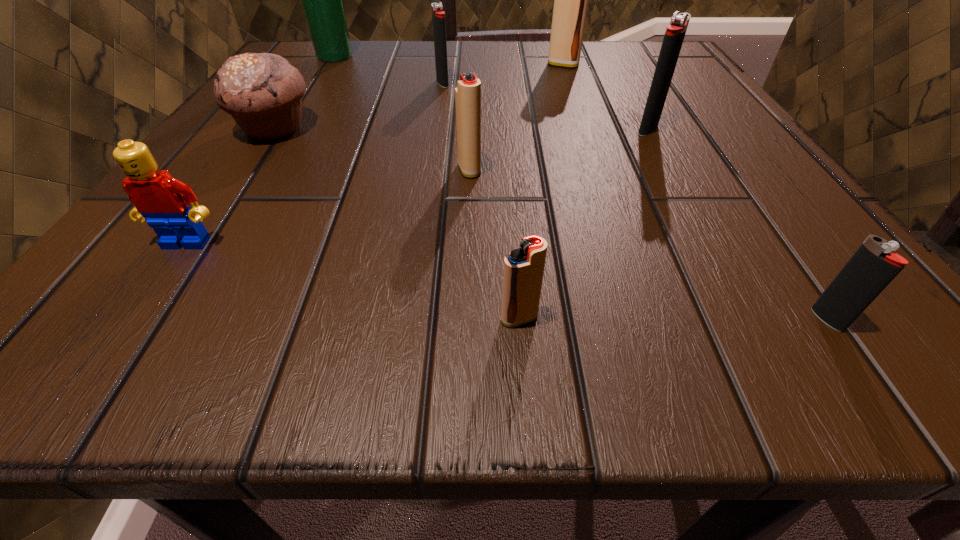
Find the location of `vacant space that is in between the muffin and the smallest red igniter`. vacant space that is in between the muffin and the smallest red igniter is located at coordinates (396, 224).

This screenshot has width=960, height=540. I want to click on vacant area that lies between the red Lego and the nearest red igniter, so pos(353,281).

The image size is (960, 540). What are the coordinates of `vacant area that lies between the fourth farthest igniter and the rightmost igniter` in the screenshot? It's located at (648, 245).

Locate an element on the screen. The height and width of the screenshot is (540, 960). free space that is in between the leftmost igniter and the Lego is located at coordinates (315, 163).

Identify the location of vacant area that lies between the Lego and the farthest black igniter. The height and width of the screenshot is (540, 960). (315, 163).

Image resolution: width=960 pixels, height=540 pixels. I want to click on blank region between the sixth object from right to left and the second igniter from right to left, so click(545, 106).

Identify which object is the third closest to the nearest black igniter. Please provide its 2D coordinates. Your answer should be formatted as a tuple, i.e. [(x, y)], where the tuple contains the x and y coordinates of a point satisfying the conditions above.

[(468, 90)]

Image resolution: width=960 pixels, height=540 pixels. I want to click on the fifth closest object to the tallest object, so click(162, 200).

Find the location of a particular element. The width and height of the screenshot is (960, 540). the third closest igniter relative to the muffin is located at coordinates (523, 272).

Find the location of a particular element. The height and width of the screenshot is (540, 960). the fourth closest igniter to the muffin is located at coordinates (571, 0).